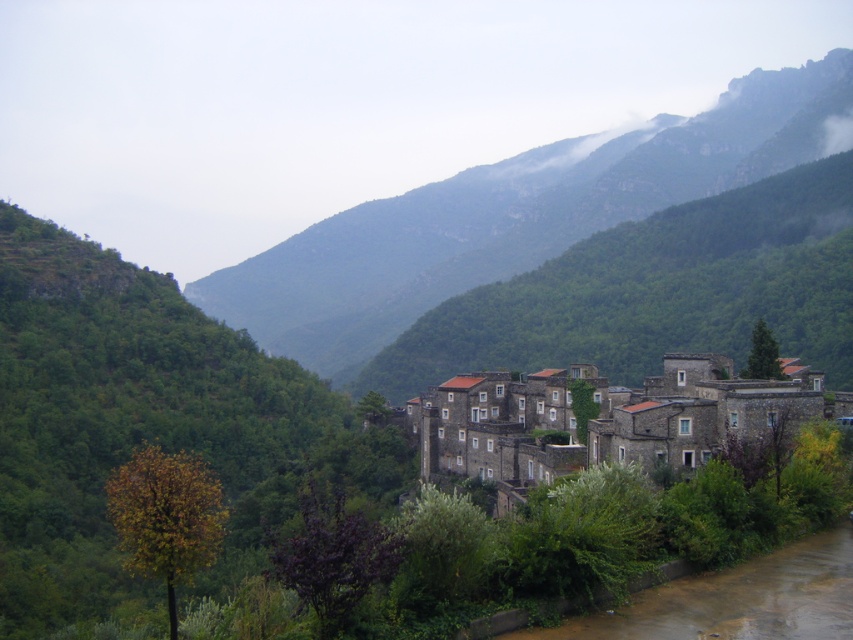
Question: Which object is positioned farthest from the brown muddy water at lower right?

Choices:
 (A) stone village at center
 (B) green rocky mountain at center

Answer: (B)

Question: Does green rocky mountain at center appear under brown muddy water at lower right?

Choices:
 (A) no
 (B) yes

Answer: (A)

Question: Can you confirm if green rocky mountain at center is positioned to the left of brown muddy water at lower right?

Choices:
 (A) yes
 (B) no

Answer: (B)

Question: Which point appears closest to the camera in this image?

Choices:
 (A) (585, 632)
 (B) (646, 470)

Answer: (A)

Question: Is green rocky mountain at center to the right of brown muddy water at lower right from the viewer's perspective?

Choices:
 (A) no
 (B) yes

Answer: (B)

Question: Which of the following is the closest to the observer?

Choices:
 (A) (308, 228)
 (B) (769, 566)

Answer: (B)